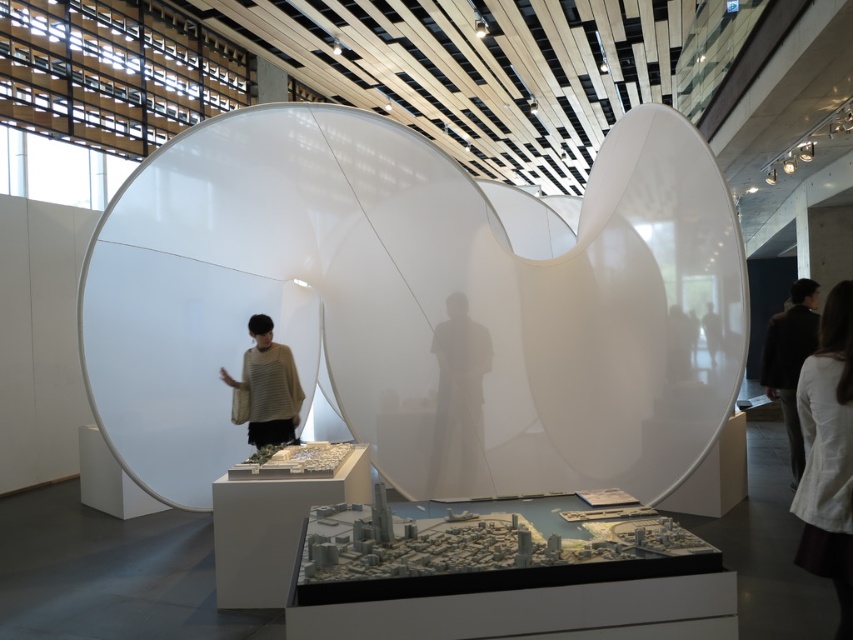
Is white fabric at center smaller than striped sweater at center?

Yes.

Which is in front, point (844, 472) or point (271, 376)?

Positioned in front is point (844, 472).

This screenshot has height=640, width=853. Find the location of `white fabric at center`. white fabric at center is located at coordinates (828, 452).

Is white fabric at center smaller than dark brown suit at right?

Yes, white fabric at center is smaller than dark brown suit at right.

Which of these two, white fabric at center or dark brown suit at right, stands taller?

dark brown suit at right is taller.

What do you see at coordinates (828, 452) in the screenshot?
I see `white fabric at center` at bounding box center [828, 452].

You are a GUI agent. You are given a task and a screenshot of the screen. Output one action in this format:
    pyautogui.click(x=<x>, y=<y>)
    Task: Click on the white fabric at center
    
    Given the screenshot: What is the action you would take?
    pyautogui.click(x=828, y=452)

Can you confirm if striped sweater at center is smaller than dark brown suit at right?

Yes.

Is point (270, 397) farther from viewer compared to point (807, 342)?

No, (270, 397) is in front of (807, 342).

Locate an element on the screen. This screenshot has width=853, height=640. striped sweater at center is located at coordinates (267, 387).